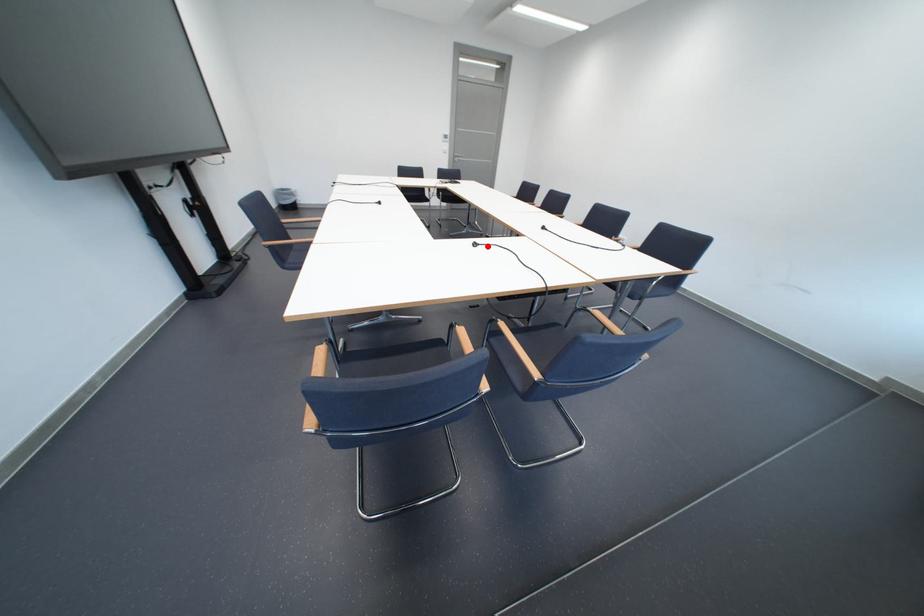
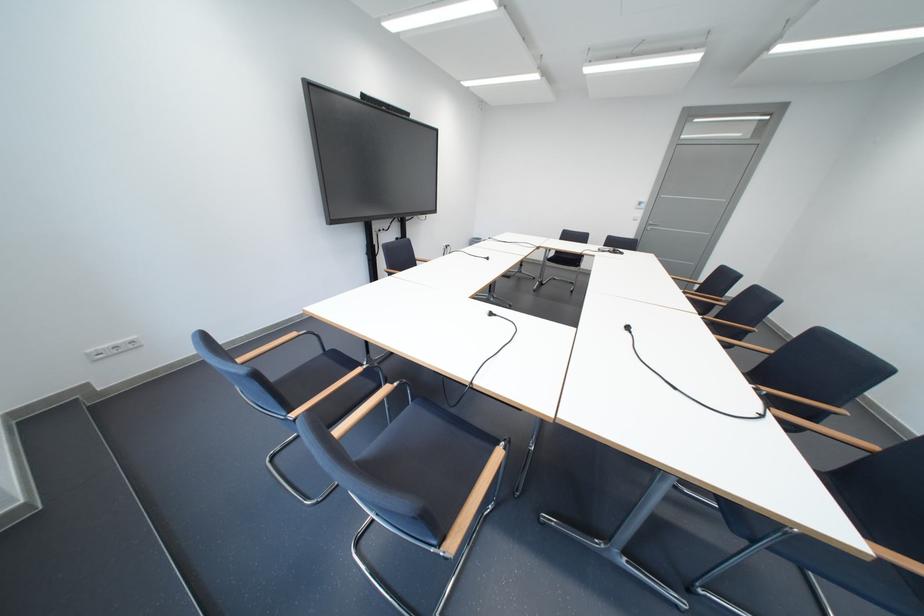
In the second image, find the point that corresponds to the highlighted location in the first image.

(503, 315)